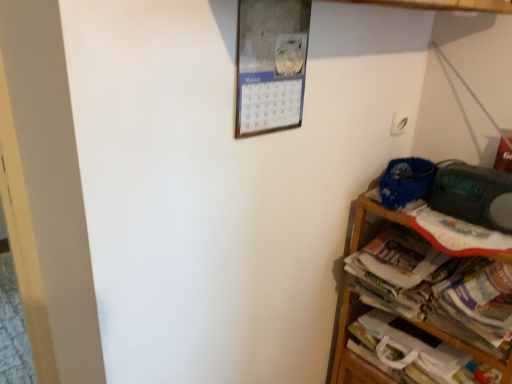
This screenshot has height=384, width=512. I want to click on white paper magazine at right, so click(436, 287).

What do you see at coordinates (443, 5) in the screenshot? I see `wooden shelf at right` at bounding box center [443, 5].

Where is `white paper magazine at right`? white paper magazine at right is located at coordinates (436, 287).

From a real-world perspective, is wooden shelf at right positioned under white paper book at lower right based on gravity?

No, from a real-world perspective, wooden shelf at right is not under white paper book at lower right.

Is wooden shelf at right surrounding white paper book at lower right?

Yes, white paper book at lower right is a part of wooden shelf at right.

Consider the image. Which point is more distant from viewer, (356, 359) or (358, 337)?

The point (356, 359) is farther from the camera.

Considering the relative sizes of white paper book at lower right and white paper magazine at right in the image provided, is white paper book at lower right bigger than white paper magazine at right?

Actually, white paper book at lower right might be smaller than white paper magazine at right.

Is white paper magazine at right at the back of white paper book at lower right?

No, white paper magazine at right is not at the back of white paper book at lower right.

Would you say white paper magazine at right is a long distance from white paper book at lower right?

No, white paper magazine at right is not far away from white paper book at lower right.

Considering the sizes of objects white paper magazine at right and white paper book at lower right in the image provided, who is bigger, white paper magazine at right or white paper book at lower right?

Bigger between the two is white paper magazine at right.

Which object is wider, white paper magazine at right or white paper book at lower right?

white paper magazine at right.

Considering the sizes of objects white paper magazine at right and white paper book at lower right in the image provided, who is taller, white paper magazine at right or white paper book at lower right?

With more height is white paper magazine at right.

Considering the relative sizes of white paper magazine at right and wooden shelf at right in the image provided, is white paper magazine at right taller than wooden shelf at right?

Incorrect, the height of white paper magazine at right is not larger of that of wooden shelf at right.

Is there a large distance between white paper magazine at right and wooden shelf at right?

No, white paper magazine at right is not far from wooden shelf at right.

Is white paper magazine at right oriented towards wooden shelf at right?

Yes, white paper magazine at right is facing wooden shelf at right.

From the picture: From a real-world perspective, who is located lower, white paper magazine at right or wooden shelf at right?

wooden shelf at right is physically lower.

In terms of width, does wooden shelf at right look wider or thinner when compared to white paper magazine at right?

Considering their sizes, wooden shelf at right looks broader than white paper magazine at right.

Would you say wooden shelf at right is to the left or to the right of white paper magazine at right in the picture?

In the image, wooden shelf at right appears on the right side of white paper magazine at right.

The width and height of the screenshot is (512, 384). Find the location of `magazine on the left of the wooden shelf at right`. magazine on the left of the wooden shelf at right is located at coordinates [436, 287].

Which object is further away from the camera, wooden shelf at right or white paper magazine at right?

Positioned behind is white paper magazine at right.

Looking at this image, from the image's perspective, does white paper book at lower right appear lower than wooden shelf at right?

Yes.

Image resolution: width=512 pixels, height=384 pixels. In order to click on book below the wooden shelf at right (from the image's perspective) in this screenshot , I will do `click(417, 351)`.

Is white paper book at lower right surrounding wooden shelf at right?

No, wooden shelf at right is not inside white paper book at lower right.

Can you confirm if white paper book at lower right is wider than wooden shelf at right?

In fact, white paper book at lower right might be narrower than wooden shelf at right.

Locate an element on the screen. This screenshot has width=512, height=384. book behind the wooden shelf at right is located at coordinates (417, 351).

Where is `magazine positioned vertically above the white paper book at lower right (from a real-world perspective)`? magazine positioned vertically above the white paper book at lower right (from a real-world perspective) is located at coordinates (436, 287).

Based on their spatial positions, is white paper magazine at right or wooden shelf at right closer to white paper book at lower right?

Based on the image, wooden shelf at right appears to be nearer to white paper book at lower right.

When comparing their distances from white paper magazine at right, does wooden shelf at right or white paper book at lower right seem further?

The object further to white paper magazine at right is wooden shelf at right.

Considering their positions, is white paper book at lower right positioned further to white paper magazine at right than wooden shelf at right?

The object further to white paper magazine at right is wooden shelf at right.

From the image, which object appears to be farther from white paper book at lower right, wooden shelf at right or white paper magazine at right?

white paper magazine at right.

Based on their spatial positions, is white paper book at lower right or white paper magazine at right closer to wooden shelf at right?

Based on the image, white paper book at lower right appears to be nearer to wooden shelf at right.

When comparing their distances from wooden shelf at right, does white paper magazine at right or white paper book at lower right seem further?

Based on the image, white paper magazine at right appears to be further to wooden shelf at right.

Where is `shelf that lies between white paper magazine at right and white paper book at lower right from top to bottom`? This screenshot has height=384, width=512. shelf that lies between white paper magazine at right and white paper book at lower right from top to bottom is located at coordinates tap(443, 5).